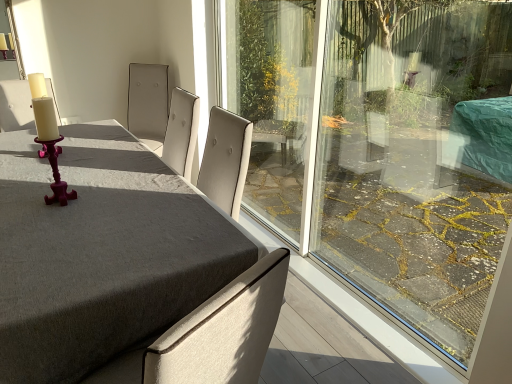
Question: Does matte gray table at center have a lesser height compared to matte purple candlestick at left?

Choices:
 (A) no
 (B) yes

Answer: (A)

Question: Is matte gray table at center behind matte purple candlestick at left?

Choices:
 (A) no
 (B) yes

Answer: (A)

Question: From the image's perspective, is matte gray table at center located beneath matte purple candlestick at left?

Choices:
 (A) yes
 (B) no

Answer: (A)

Question: Is matte gray table at center completely or partially outside of matte purple candlestick at left?

Choices:
 (A) no
 (B) yes

Answer: (B)

Question: Is matte purple candlestick at left at the back of matte gray table at center?

Choices:
 (A) no
 (B) yes

Answer: (A)

Question: Is matte gray table at center taller or shorter than matte purple candlestick at left?

Choices:
 (A) tall
 (B) short

Answer: (A)

Question: In the image, is matte gray table at center positioned in front of or behind matte purple candlestick at left?

Choices:
 (A) behind
 (B) front

Answer: (B)

Question: Is matte gray table at center spatially inside matte purple candlestick at left, or outside of it?

Choices:
 (A) inside
 (B) outside

Answer: (B)

Question: From the image's perspective, is matte gray table at center above or below matte purple candlestick at left?

Choices:
 (A) below
 (B) above

Answer: (A)

Question: Is matte white chair at left taller or shorter than matte gray table at center?

Choices:
 (A) tall
 (B) short

Answer: (B)

Question: From the image's perspective, relative to matte gray table at center, is matte white chair at left above or below?

Choices:
 (A) above
 (B) below

Answer: (A)

Question: Is matte white chair at left wider or thinner than matte gray table at center?

Choices:
 (A) thin
 (B) wide

Answer: (A)

Question: From a real-world perspective, relative to matte gray table at center, is matte white chair at left vertically above or below?

Choices:
 (A) above
 (B) below

Answer: (A)

Question: In the image, is matte white chair at left on the left side or the right side of matte purple candlestick at left?

Choices:
 (A) right
 (B) left

Answer: (B)

Question: Is matte white chair at left taller or shorter than matte purple candlestick at left?

Choices:
 (A) tall
 (B) short

Answer: (B)